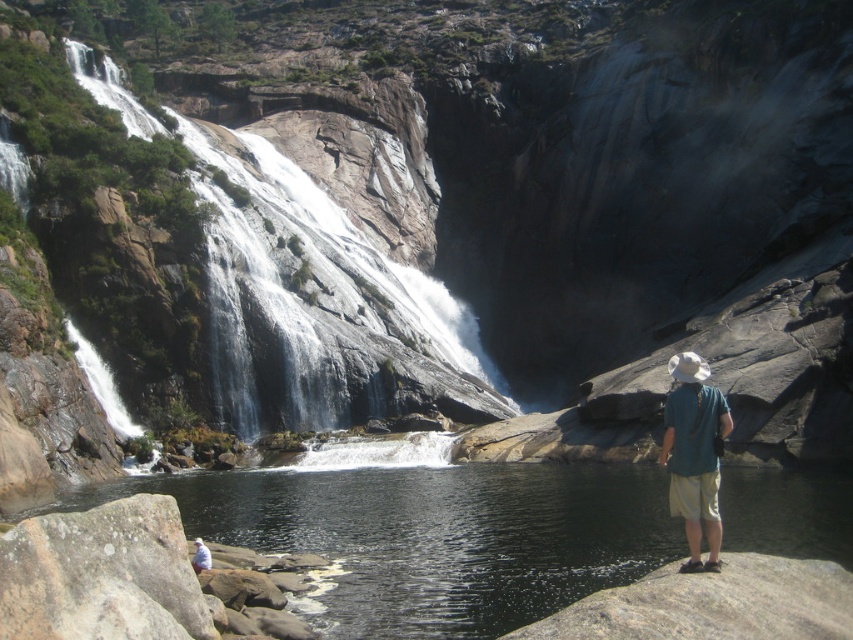
Question: Can you confirm if white textured water at left is thinner than green fabric shirt at lower right?

Choices:
 (A) no
 (B) yes

Answer: (A)

Question: Which point appears closest to the camera in this image?

Choices:
 (A) (602, 486)
 (B) (93, 624)
 (C) (668, 611)

Answer: (C)

Question: Does white textured water at left appear on the left side of gray rough rock at lower left?

Choices:
 (A) no
 (B) yes

Answer: (B)

Question: Which object is positioned farthest from the clear water at center?

Choices:
 (A) green fabric shirt at lower right
 (B) white textured water at left
 (C) white cotton shirt at lower center

Answer: (B)

Question: Which point appears farthest from the camera in this image?

Choices:
 (A) (155, 481)
 (B) (138, 509)
 (C) (683, 356)

Answer: (A)

Question: Is clear water at center above green fabric shirt at lower right?

Choices:
 (A) yes
 (B) no

Answer: (B)